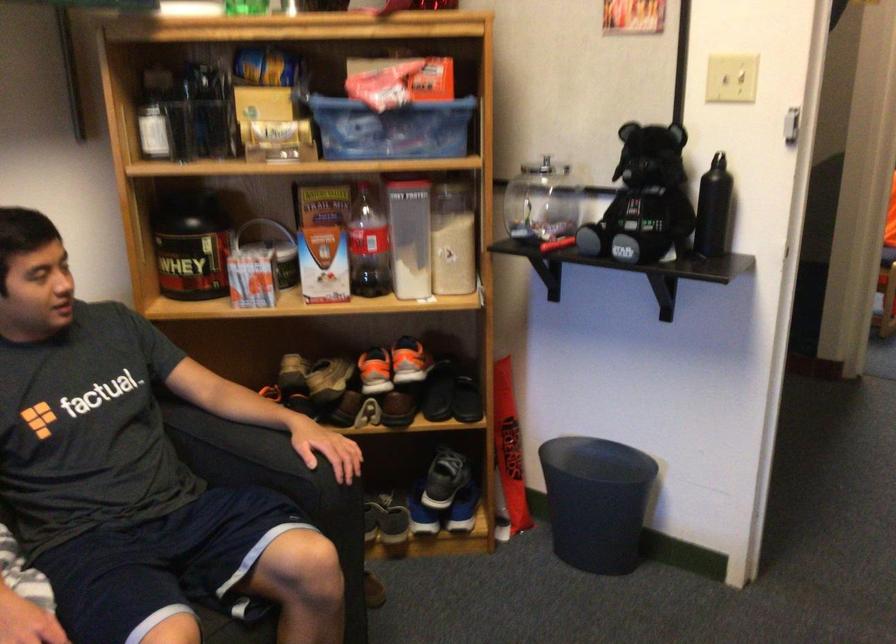
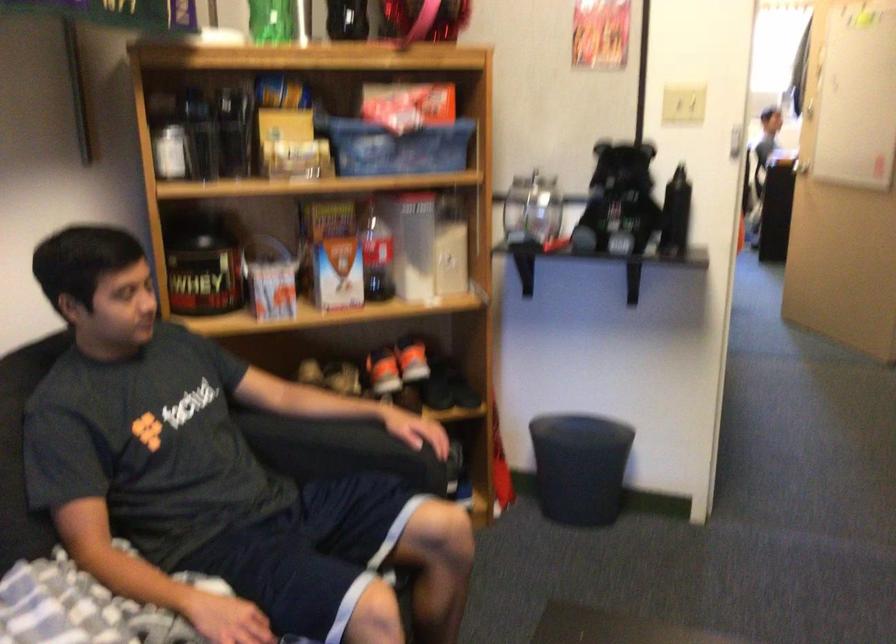
In the second image, find the point that corresponds to the point at 371,370 in the first image.

(383, 371)